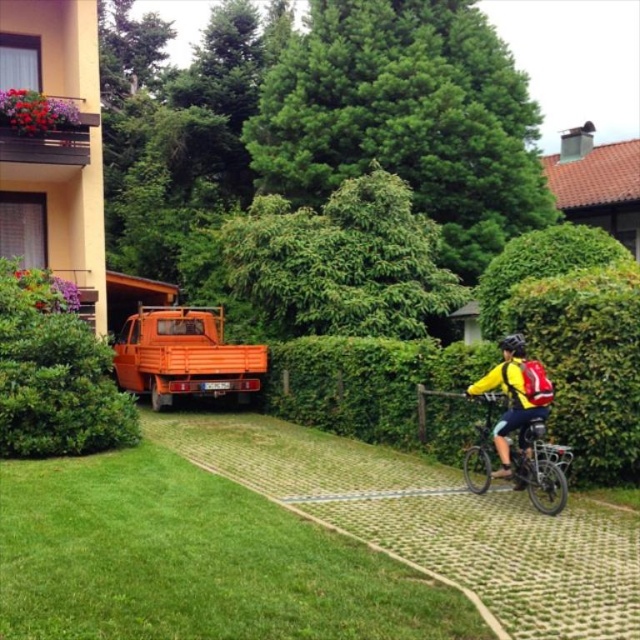
Locate an element on the screen. Image resolution: width=640 pixels, height=640 pixels. green leafy hedge at left is located at coordinates tap(54, 376).

Who is lower down, green leafy hedge at left or orange matte truck at center?

orange matte truck at center is lower down.

Is point (68, 451) farther from viewer compared to point (204, 376)?

No.

The image size is (640, 640). Find the location of `green leafy hedge at left`. green leafy hedge at left is located at coordinates (54, 376).

At what (x,y) coordinates should I click in order to perform the action: click on green leafy hedge at left. Please return your answer as a coordinate pair (x, y). Looking at the image, I should click on (54, 376).

Is green leafy hedge at left above metallic silver bicycle at right?

Yes.

Which is behind, point (0, 435) or point (554, 497)?

The point (0, 435) is behind.

The image size is (640, 640). Identify the location of green leafy hedge at left. (54, 376).

Where is `green leafy hedge at left`? This screenshot has height=640, width=640. green leafy hedge at left is located at coordinates (54, 376).

The height and width of the screenshot is (640, 640). Describe the element at coordinates (54, 376) in the screenshot. I see `green leafy hedge at left` at that location.

The height and width of the screenshot is (640, 640). I want to click on green leafy hedge at left, so click(54, 376).